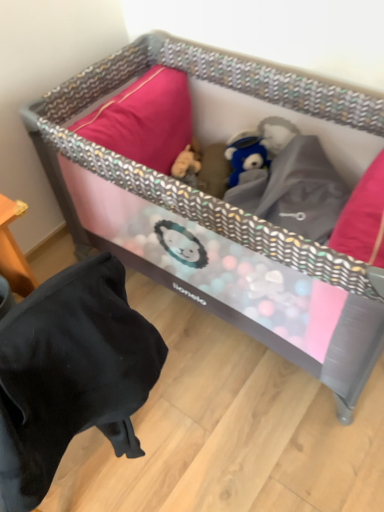
Question: Considering the relative positions of pink fabric playpen at center and black fabric bean bag chair at lower left in the image provided, is pink fabric playpen at center to the left of black fabric bean bag chair at lower left from the viewer's perspective?

Choices:
 (A) yes
 (B) no

Answer: (B)

Question: From the image's perspective, is pink fabric playpen at center located above black fabric bean bag chair at lower left?

Choices:
 (A) yes
 (B) no

Answer: (A)

Question: Can black fabric bean bag chair at lower left be found inside pink fabric playpen at center?

Choices:
 (A) no
 (B) yes

Answer: (A)

Question: From a real-world perspective, is pink fabric playpen at center on top of black fabric bean bag chair at lower left?

Choices:
 (A) yes
 (B) no

Answer: (B)

Question: Is pink fabric playpen at center facing away from black fabric bean bag chair at lower left?

Choices:
 (A) no
 (B) yes

Answer: (A)

Question: Is pink fabric playpen at center shorter than black fabric bean bag chair at lower left?

Choices:
 (A) no
 (B) yes

Answer: (B)

Question: Is black fabric bean bag chair at lower left thinner than fuzzy brown stuffed animal at center?

Choices:
 (A) yes
 (B) no

Answer: (B)

Question: Could fuzzy brown stuffed animal at center be considered to be inside black fabric bean bag chair at lower left?

Choices:
 (A) no
 (B) yes

Answer: (A)

Question: Can you confirm if black fabric bean bag chair at lower left is smaller than fuzzy brown stuffed animal at center?

Choices:
 (A) no
 (B) yes

Answer: (A)

Question: Is black fabric bean bag chair at lower left taller than fuzzy brown stuffed animal at center?

Choices:
 (A) yes
 (B) no

Answer: (A)

Question: Is the surface of black fabric bean bag chair at lower left in direct contact with fuzzy brown stuffed animal at center?

Choices:
 (A) yes
 (B) no

Answer: (B)

Question: Is black fabric bean bag chair at lower left to the left of fuzzy brown stuffed animal at center from the viewer's perspective?

Choices:
 (A) no
 (B) yes

Answer: (B)

Question: Can you confirm if black fabric bean bag chair at lower left is positioned to the left of pink fabric playpen at center?

Choices:
 (A) yes
 (B) no

Answer: (A)